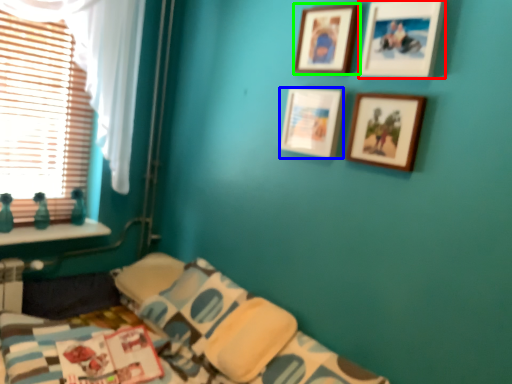
Question: Which object is the closest to the picture frame (highlighted by a red box)? Choose among these: picture frame (highlighted by a blue box) or picture frame (highlighted by a green box).

Choices:
 (A) picture frame
 (B) picture frame

Answer: (B)